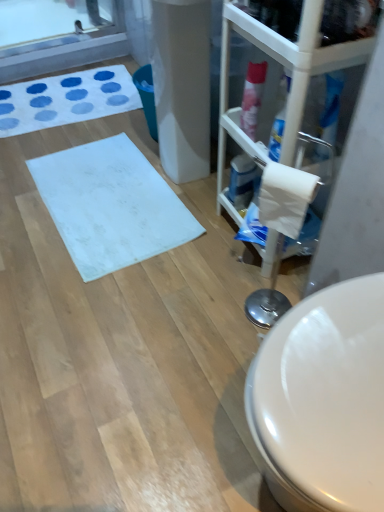
Question: Does blue glossy spray can at center-right, marked as the second cleaning product in a front-to-back arrangement, lie in front of transparent plastic glass door at right?

Choices:
 (A) yes
 (B) no

Answer: (B)

Question: Is blue glossy spray can at center-right, which is the 2th cleaning product in top-to-bottom order, thinner than transparent plastic glass door at right?

Choices:
 (A) yes
 (B) no

Answer: (A)

Question: From a real-world perspective, is blue glossy spray can at center-right, the 1th cleaning product from the back, over transparent plastic glass door at right?

Choices:
 (A) no
 (B) yes

Answer: (A)

Question: Is blue glossy spray can at center-right, the 1th cleaning product positioned from the bottom, bigger than transparent plastic glass door at right?

Choices:
 (A) no
 (B) yes

Answer: (A)

Question: Is blue glossy spray can at center-right, the 1th cleaning product from the back, outside transparent plastic glass door at right?

Choices:
 (A) no
 (B) yes

Answer: (A)

Question: From a real-world perspective, is blue glossy spray can at center-right, the 1th cleaning product from the back, beneath transparent plastic glass door at right?

Choices:
 (A) no
 (B) yes

Answer: (B)

Question: Is blue glossy spray can at center-right, the 1th cleaning product from the back, at the right side of white matte toilet paper at right?

Choices:
 (A) yes
 (B) no

Answer: (B)

Question: Is the position of blue glossy spray can at center-right, which is the 2th cleaning product in top-to-bottom order, more distant than that of white matte toilet paper at right?

Choices:
 (A) yes
 (B) no

Answer: (A)

Question: Is white matte toilet paper at right a part of blue glossy spray can at center-right, the 1th cleaning product from the back?

Choices:
 (A) yes
 (B) no

Answer: (B)

Question: Is blue glossy spray can at center-right, which is the 2th cleaning product in top-to-bottom order, not close to white matte toilet paper at right?

Choices:
 (A) no
 (B) yes

Answer: (A)

Question: Is blue glossy spray can at center-right, the 1th cleaning product from the back, bigger than white matte toilet paper at right?

Choices:
 (A) no
 (B) yes

Answer: (A)

Question: Considering the relative sizes of blue glossy spray can at center-right, which is the 2th cleaning product in top-to-bottom order, and white matte toilet paper at right in the image provided, is blue glossy spray can at center-right, which is the 2th cleaning product in top-to-bottom order, wider than white matte toilet paper at right?

Choices:
 (A) yes
 (B) no

Answer: (B)

Question: Does white fabric bath mat at upper left, which is the 2th bath mat in front-to-back order, have a larger size compared to white matte bath mat at center, which is counted as the second bath mat, starting from the top?

Choices:
 (A) yes
 (B) no

Answer: (A)